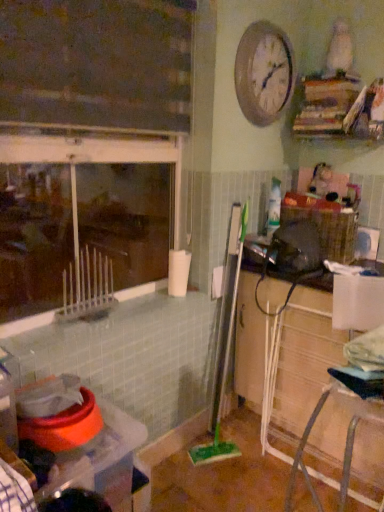
Image resolution: width=384 pixels, height=512 pixels. I want to click on free point above metallic silver clock at upper center (from a real-world perspective), so click(266, 18).